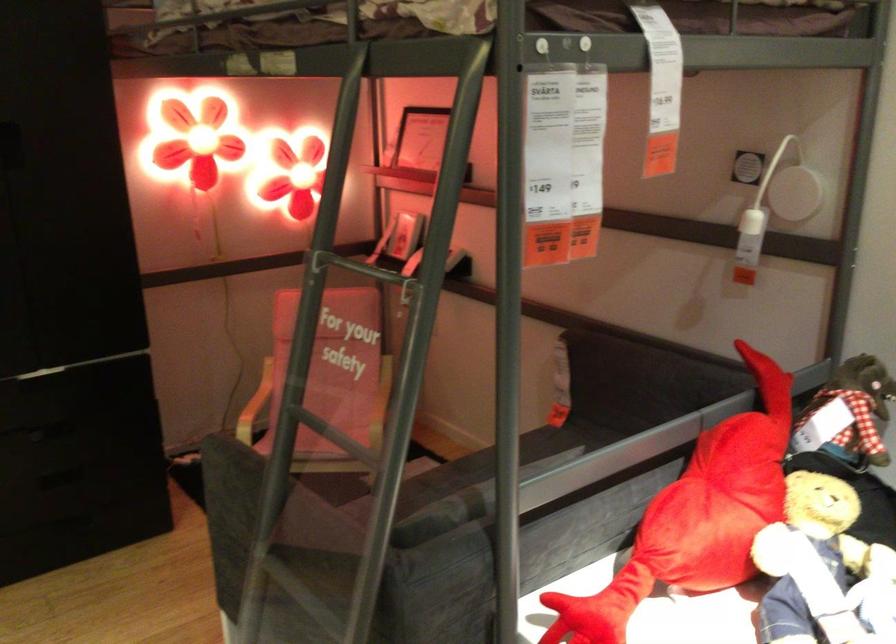
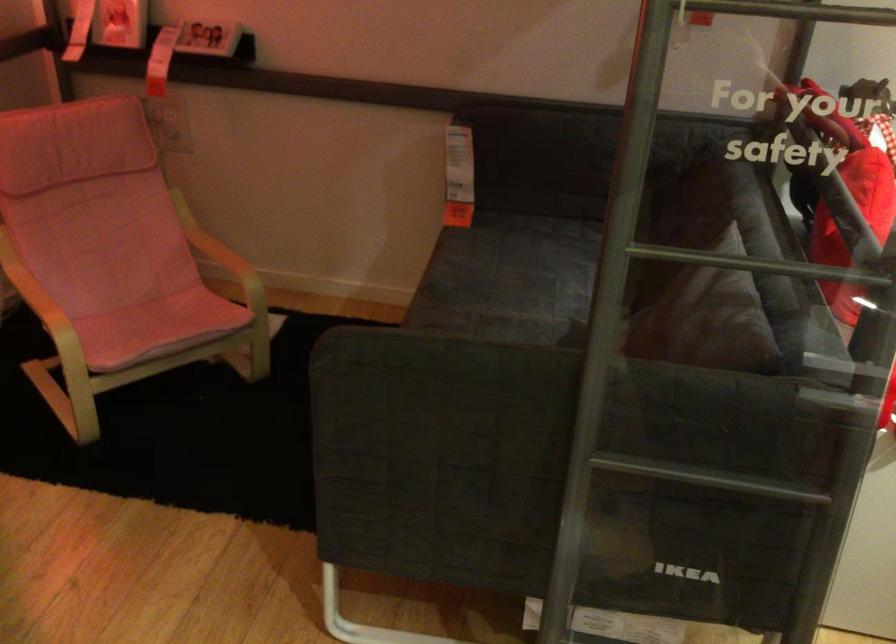
Where in the second image is the point corresponding to (x=334, y=436) from the first image?

(760, 263)